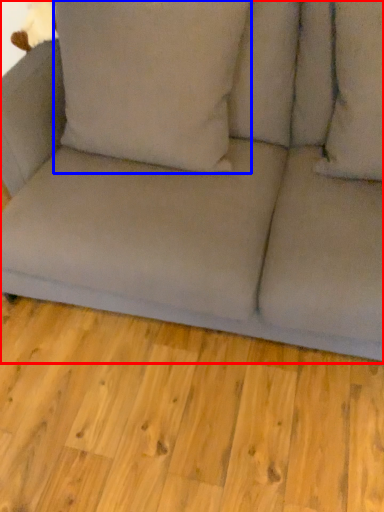
Question: Which object appears closest to the camera in this image, studio couch (highlighted by a red box) or pillow (highlighted by a blue box)?

Choices:
 (A) studio couch
 (B) pillow

Answer: (A)